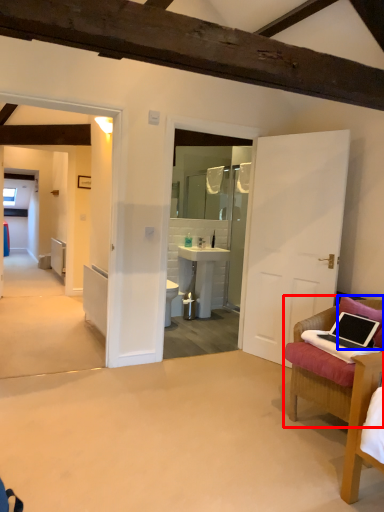
Question: Which point is closer to the camera, chair (highlighted by a red box) or pillow (highlighted by a blue box)?

Choices:
 (A) chair
 (B) pillow

Answer: (A)